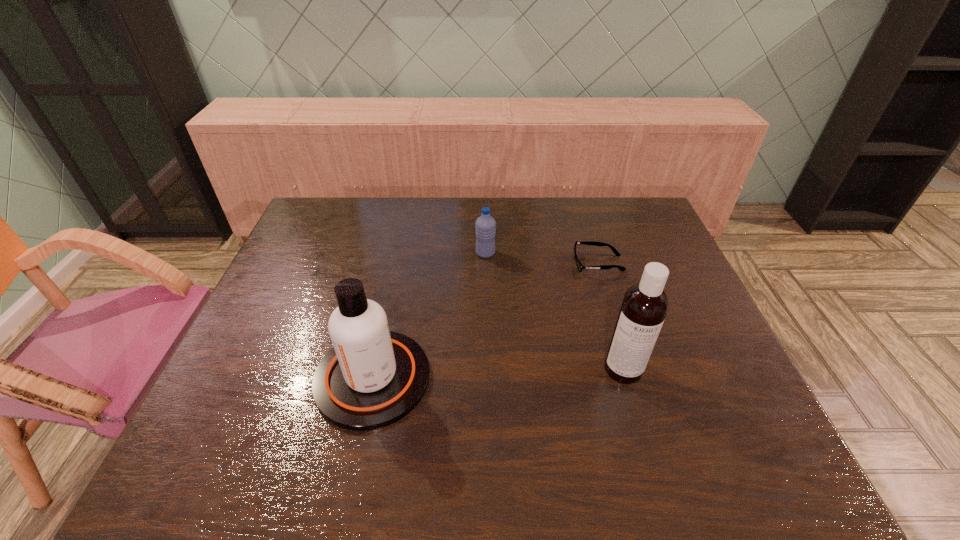
Find the location of `free space between the third object from right to left and the leftmost object`. free space between the third object from right to left and the leftmost object is located at coordinates (429, 316).

You are a GUI agent. You are given a task and a screenshot of the screen. Output one action in this format:
    pyautogui.click(x=<x>, y=<y>)
    Task: Click on the unoccupied position between the leftmost object and the dishwasher detergent
    
    Given the screenshot: What is the action you would take?
    pyautogui.click(x=498, y=374)

Where is `free point between the sunglasses and the leftmost object`? This screenshot has width=960, height=540. free point between the sunglasses and the leftmost object is located at coordinates (486, 321).

The width and height of the screenshot is (960, 540). What are the coordinates of `empty space between the shortest object and the dishwasher detergent` in the screenshot? It's located at (611, 316).

I want to click on unoccupied area between the dishwasher detergent and the sunglasses, so click(611, 316).

Find the location of `vacant area that lies between the shortest object and the water bottle`. vacant area that lies between the shortest object and the water bottle is located at coordinates (541, 258).

Find the location of a particular element. object that can be found as the second closest to the shortest object is located at coordinates (645, 305).

You are a GUI agent. You are given a task and a screenshot of the screen. Output one action in this format:
    pyautogui.click(x=<x>, y=<y>)
    Task: Click on the third closest object to the water bottle
    
    Given the screenshot: What is the action you would take?
    pyautogui.click(x=645, y=305)

Where is `blank space that satisfies the following two spatial constraints: 1. on the front-facing side of the sunglasses; 2. on the label side of the dishwasher detergent`? blank space that satisfies the following two spatial constraints: 1. on the front-facing side of the sunglasses; 2. on the label side of the dishwasher detergent is located at coordinates (631, 369).

You are a GUI agent. You are given a task and a screenshot of the screen. Output one action in this format:
    pyautogui.click(x=<x>, y=<y>)
    Task: Click on the vacant space that satisfies the following two spatial constraints: 1. on the front-facing side of the shortest object; 2. on the label side of the dishwasher detergent
    
    Given the screenshot: What is the action you would take?
    pyautogui.click(x=631, y=369)